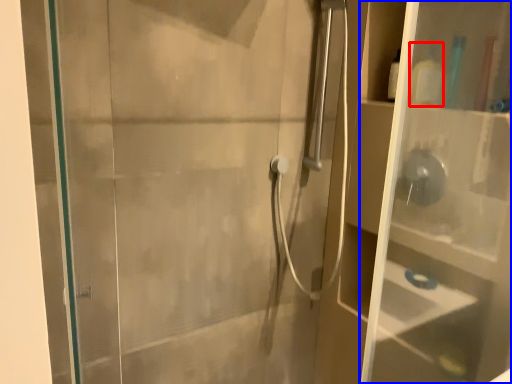
Question: Which object is closer to the camera taking this photo, toiletry (highlighted by a red box) or glass box (highlighted by a blue box)?

Choices:
 (A) toiletry
 (B) glass box

Answer: (B)